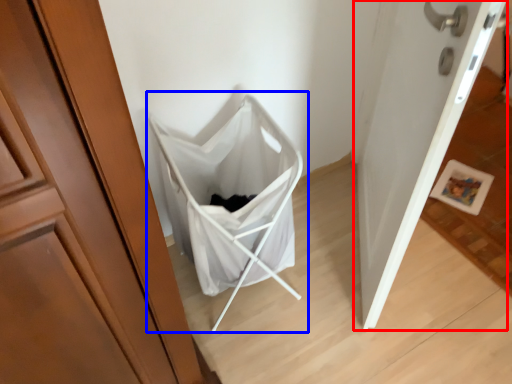
Question: Which object is closer to the camera taking this photo, door (highlighted by a red box) or baby carriage (highlighted by a blue box)?

Choices:
 (A) door
 (B) baby carriage

Answer: (A)